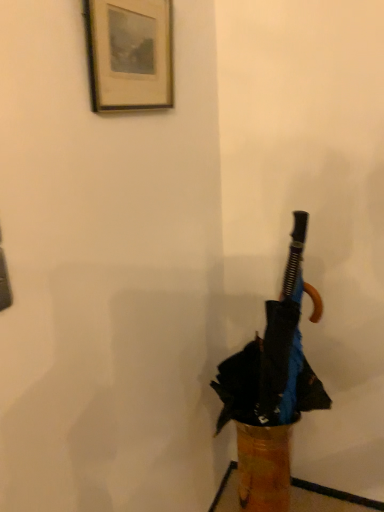
Locate an element on the screen. This screenshot has height=512, width=384. wooden framed print at upper left is located at coordinates click(129, 54).

Looking at this image, what is the approximate width of wooden framed print at upper left?

The width of wooden framed print at upper left is 2.31 inches.

The height and width of the screenshot is (512, 384). Describe the element at coordinates (129, 54) in the screenshot. I see `wooden framed print at upper left` at that location.

In order to face wooden framed print at upper left, should I rotate leftwards or rightwards?

It's best to rotate left around 5.829 degrees.

In order to face black matte umbrella at center, should I rotate leftwards or rightwards?

Turn right approximately 10.376 degrees to face it.

What is the approximate width of black matte umbrella at center?

black matte umbrella at center is 14.39 inches in width.

Image resolution: width=384 pixels, height=512 pixels. Identify the location of black matte umbrella at center. (274, 359).

Describe the element at coordinates (274, 359) in the screenshot. Image resolution: width=384 pixels, height=512 pixels. I see `black matte umbrella at center` at that location.

The width and height of the screenshot is (384, 512). Identify the location of wooden framed print at upper left. (129, 54).

Between wooden framed print at upper left and black matte umbrella at center, which one appears on the right side from the viewer's perspective?

black matte umbrella at center is more to the right.

From the picture: Is the position of wooden framed print at upper left more distant than that of black matte umbrella at center?

No, wooden framed print at upper left is closer to the viewer.

Is point (143, 4) closer or farther from the camera than point (270, 364)?

Point (143, 4).

From the image's perspective, is wooden framed print at upper left beneath black matte umbrella at center?

No.

From a real-world perspective, which is physically above, wooden framed print at upper left or black matte umbrella at center?

wooden framed print at upper left.

In the scene shown: Is wooden framed print at upper left wider than black matte umbrella at center?

In fact, wooden framed print at upper left might be narrower than black matte umbrella at center.

Is wooden framed print at upper left taller or shorter than black matte umbrella at center?

Clearly, wooden framed print at upper left is shorter compared to black matte umbrella at center.

Is wooden framed print at upper left smaller than black matte umbrella at center?

Yes.

Would you say wooden framed print at upper left contains black matte umbrella at center?

No, black matte umbrella at center is not a part of wooden framed print at upper left.

Looking at this image, is wooden framed print at upper left beside black matte umbrella at center?

No, wooden framed print at upper left is not in contact with black matte umbrella at center.

Is wooden framed print at upper left facing towards black matte umbrella at center?

No.

This screenshot has width=384, height=512. Find the location of `picture frame located in front of the black matte umbrella at center`. picture frame located in front of the black matte umbrella at center is located at coordinates (129, 54).

Based on their positions, is black matte umbrella at center located to the left or right of wooden framed print at upper left?

In the image, black matte umbrella at center appears on the right side of wooden framed print at upper left.

Between black matte umbrella at center and wooden framed print at upper left, which one is positioned in front?

wooden framed print at upper left is more forward.

Which is in front, point (305, 370) or point (154, 106)?

Point (154, 106)

From the image's perspective, which one is positioned higher, black matte umbrella at center or wooden framed print at upper left?

From the image's view, wooden framed print at upper left is above.

From a real-world perspective, is black matte umbrella at center over wooden framed print at upper left?

Actually, black matte umbrella at center is physically below wooden framed print at upper left in the real world.

Between black matte umbrella at center and wooden framed print at upper left, which one has larger width?

black matte umbrella at center is wider.

Who is shorter, black matte umbrella at center or wooden framed print at upper left?

wooden framed print at upper left is shorter.

Who is smaller, black matte umbrella at center or wooden framed print at upper left?

wooden framed print at upper left is smaller.

Looking at this image, do you think black matte umbrella at center is within wooden framed print at upper left, or outside of it?

black matte umbrella at center lies outside wooden framed print at upper left.

Can you see black matte umbrella at center touching wooden framed print at upper left?

No, black matte umbrella at center is not beside wooden framed print at upper left.

Is black matte umbrella at center looking in the opposite direction of wooden framed print at upper left?

black matte umbrella at center does not have its back to wooden framed print at upper left.

How different are the orientations of black matte umbrella at center and wooden framed print at upper left in degrees?

The angular difference between black matte umbrella at center and wooden framed print at upper left is 92 degrees.

Identify the location of umbrella below the wooden framed print at upper left (from the image's perspective). The height and width of the screenshot is (512, 384). (274, 359).

Identify the location of umbrella that is on the right side of wooden framed print at upper left. The width and height of the screenshot is (384, 512). (274, 359).

I want to click on umbrella that is below the wooden framed print at upper left (from the image's perspective), so click(274, 359).